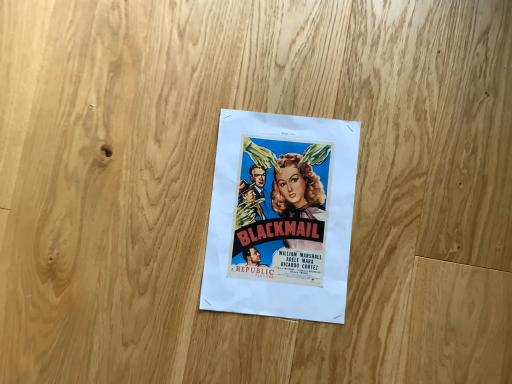
This screenshot has width=512, height=384. What do you see at coordinates (281, 216) in the screenshot? I see `white paper poster at center` at bounding box center [281, 216].

Locate an element on the screen. white paper poster at center is located at coordinates (281, 216).

Find the location of a particular element. The width and height of the screenshot is (512, 384). white paper poster at center is located at coordinates (281, 216).